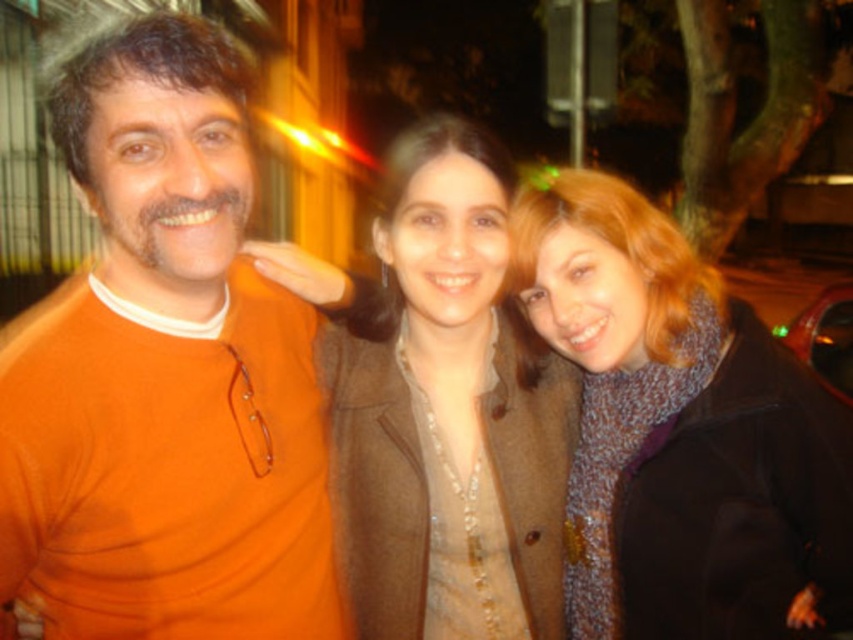
Question: Is orange matte sweater at left smaller than brown woolen coat at center?

Choices:
 (A) no
 (B) yes

Answer: (A)

Question: Observing the image, what is the correct spatial positioning of orange matte sweater at left in reference to knitted scarf at center?

Choices:
 (A) above
 (B) below

Answer: (A)

Question: In this image, where is orange matte sweater at left located relative to knitted scarf at center?

Choices:
 (A) above
 (B) below

Answer: (A)

Question: Which point is closer to the camera taking this photo?

Choices:
 (A) (448, 621)
 (B) (287, 385)
 (C) (838, 401)

Answer: (C)

Question: Estimate the real-world distances between objects in this image. Which object is farther from the orange matte sweater at left?

Choices:
 (A) knitted scarf at center
 (B) brown woolen coat at center

Answer: (A)

Question: Which is farther from the brown woolen coat at center?

Choices:
 (A) knitted scarf at center
 (B) orange matte sweater at left

Answer: (B)